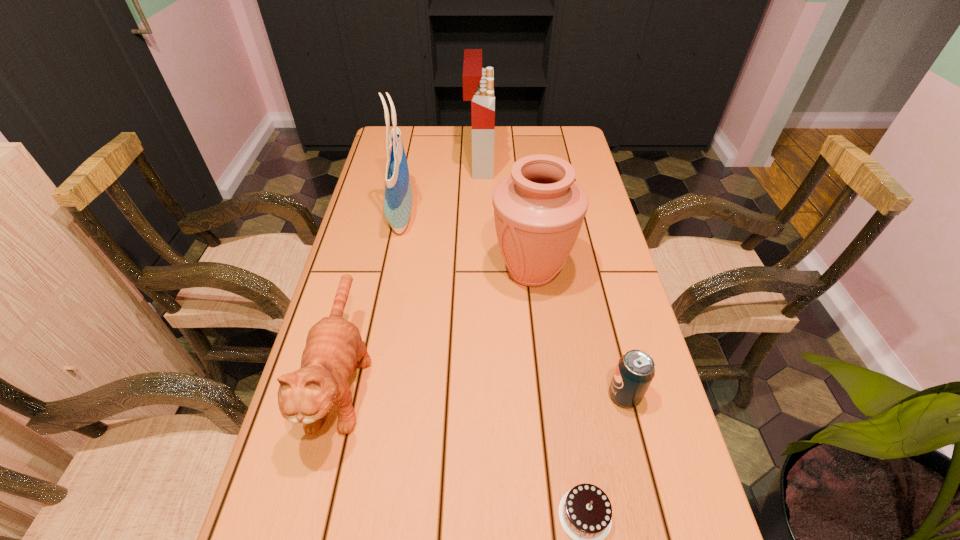
At what (x,y) coordinates should I click in order to perform the action: click on vacant space located on the left of the fifth tallest object. Please return your answer as a coordinate pair (x, y). The image size is (960, 540). Looking at the image, I should click on (494, 395).

The image size is (960, 540). I want to click on object at the far edge, so click(478, 83).

This screenshot has width=960, height=540. Find the location of `tote bag present at the left edge`. tote bag present at the left edge is located at coordinates (398, 193).

The width and height of the screenshot is (960, 540). What are the coordinates of `cat present at the left edge` in the screenshot? It's located at (334, 348).

The height and width of the screenshot is (540, 960). What are the coordinates of `vase located in the right edge section of the desktop` in the screenshot? It's located at (539, 209).

Locate an element on the screen. This screenshot has height=540, width=960. soda can that is positioned at the right edge is located at coordinates (635, 371).

In the image, there is a desktop. In order to click on blank space at the far edge in this screenshot , I will do `click(522, 139)`.

The height and width of the screenshot is (540, 960). I want to click on blank space at the left edge of the desktop, so click(x=350, y=526).

Image resolution: width=960 pixels, height=540 pixels. In order to click on free region at the right edge of the desktop in this screenshot , I will do `click(587, 412)`.

This screenshot has height=540, width=960. Find the location of `vacant region at the far left corner of the desktop`. vacant region at the far left corner of the desktop is located at coordinates (381, 138).